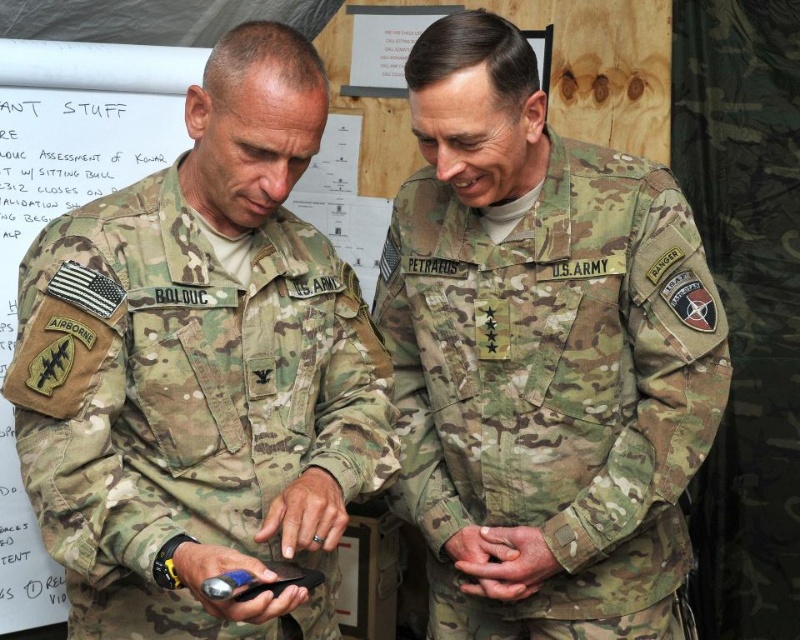
Question: Where is camouflage uniform at center located in relation to camouflage fabric us army uniform at center in the image?

Choices:
 (A) above
 (B) below

Answer: (A)

Question: Is camouflage uniform at center positioned before camouflage fabric us army uniform at center?

Choices:
 (A) yes
 (B) no

Answer: (A)

Question: Among these objects, which one is nearest to the camera?

Choices:
 (A) camouflage uniform at center
 (B) camouflage fabric us army uniform at center

Answer: (A)

Question: Which of the following is the farthest from the observer?

Choices:
 (A) click(x=190, y=308)
 (B) click(x=494, y=490)

Answer: (B)

Question: Can you confirm if camouflage uniform at center is positioned to the left of camouflage fabric us army uniform at center?

Choices:
 (A) no
 (B) yes

Answer: (B)

Question: Among these objects, which one is farthest from the camera?

Choices:
 (A) camouflage fabric us army uniform at center
 (B) camouflage uniform at center

Answer: (A)